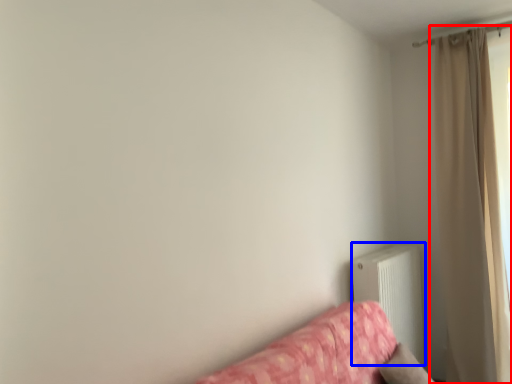
Question: Which object is further to the camera taking this photo, curtain (highlighted by a red box) or radiator (highlighted by a blue box)?

Choices:
 (A) curtain
 (B) radiator

Answer: (A)